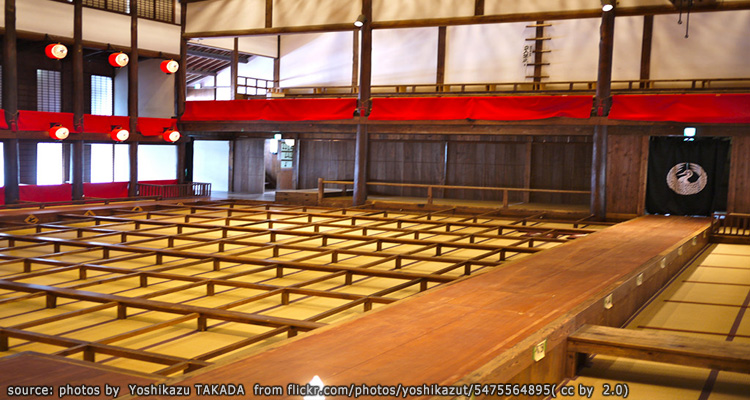
The height and width of the screenshot is (400, 750). Identify the location of lights. (361, 19).